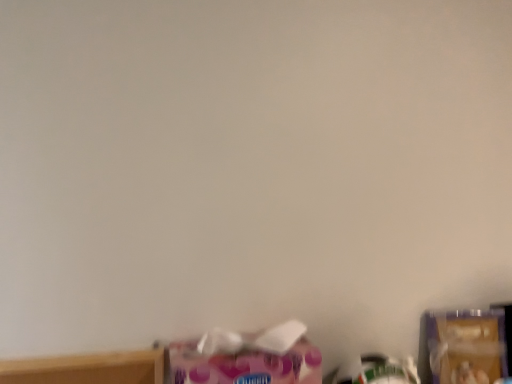
Where is `pink glossy tissue box at lower center`? The image size is (512, 384). pink glossy tissue box at lower center is located at coordinates (242, 365).

The width and height of the screenshot is (512, 384). What do you see at coordinates (242, 365) in the screenshot? I see `pink glossy tissue box at lower center` at bounding box center [242, 365].

Identify the location of pink glossy tissue box at lower center. The image size is (512, 384). (242, 365).